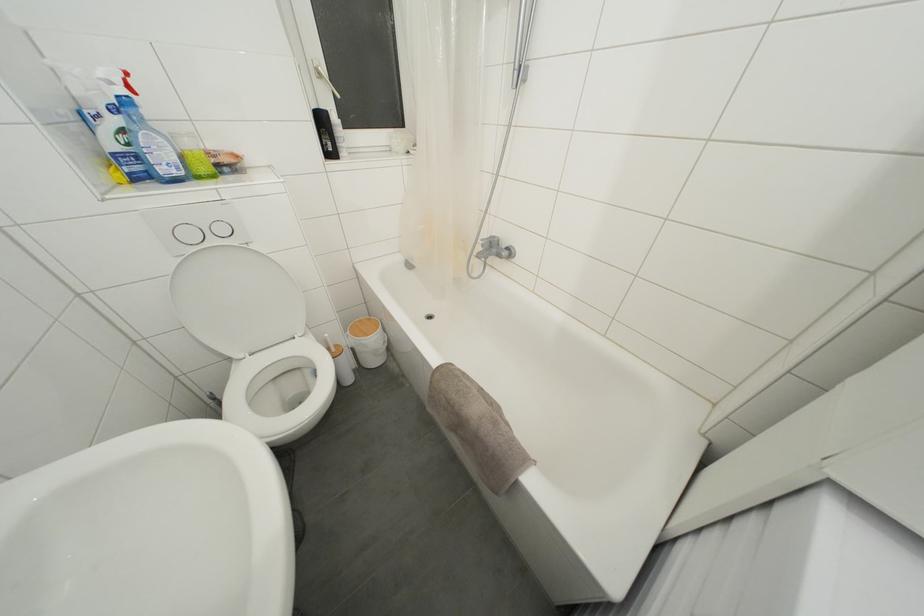
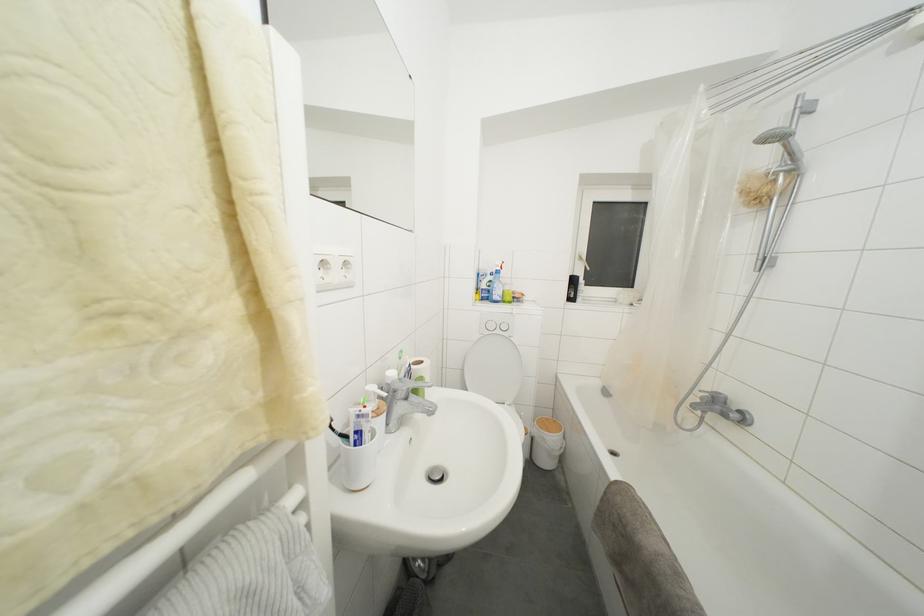
Find the pixel in the second image that matches [438,371] in the first image.

(617, 484)